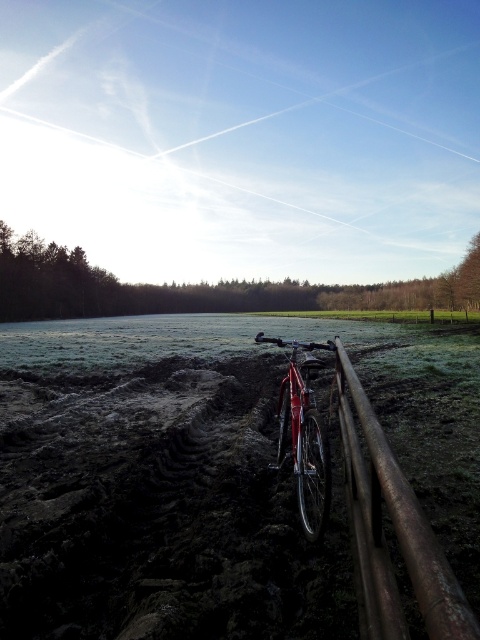
You are a cyclist who just arrived at the muddy path. You see the rusty metal fence at lower right and the shiny red bicycle at center. Which object is closer to the ground?

The rusty metal fence at lower right is positioned under the shiny red bicycle at center, so the fence is closer to the ground.

You are a delivery person who needs to quickly move your bicycle away from the fence to avoid rainwater pooling between them. The fence is rusty metal fence at lower right and the bicycle is shiny red bicycle at center. Can you move the bicycle far enough so that there is at least 1.5 meters between them?

The rusty metal fence at lower right is currently 1.26 meters away from the shiny red bicycle at center. Since 1.26 meters is less than the required 1.5 meters, you would need to move the bicycle an additional 0.24 meters away from the fence to achieve the desired distance.

You are standing on the muddy path and want to walk towards the fence. Which object will you pass first? The rusty metal fence at lower right or the shiny red bicycle at center?

You will pass the rusty metal fence at lower right first because it is in front of the shiny red bicycle at center, meaning it is closer to your current position on the muddy path.